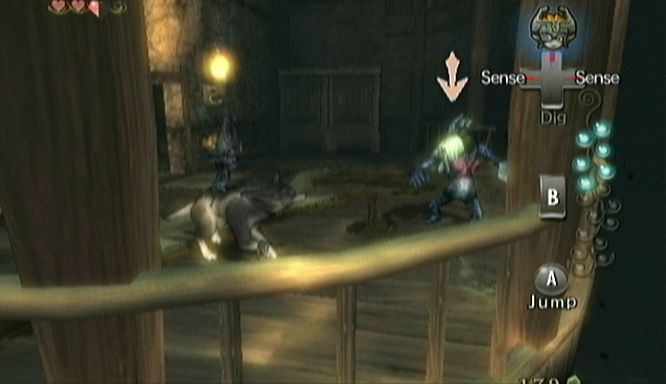
This screenshot has height=384, width=666. I want to click on spindles, so click(x=428, y=335), click(x=349, y=346), click(x=230, y=348).